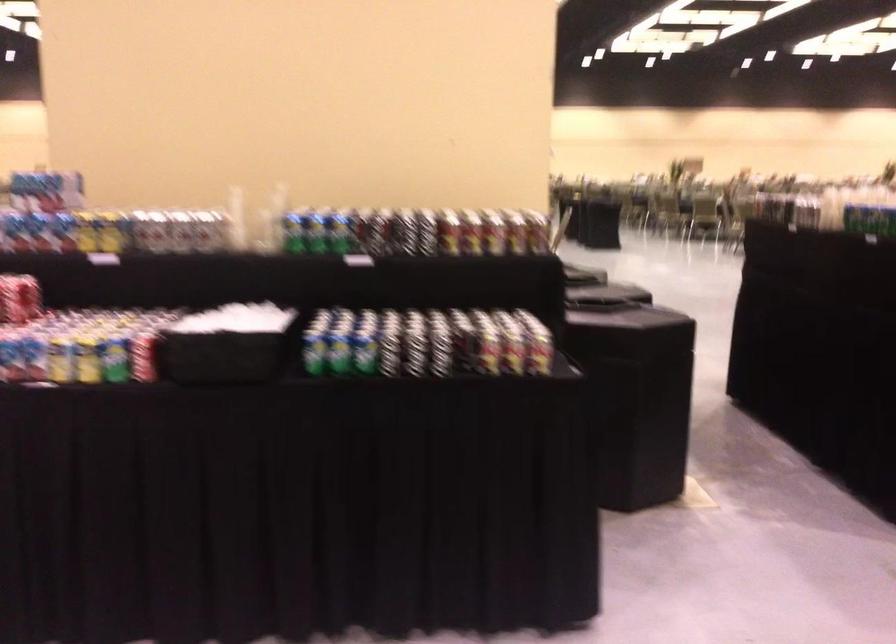
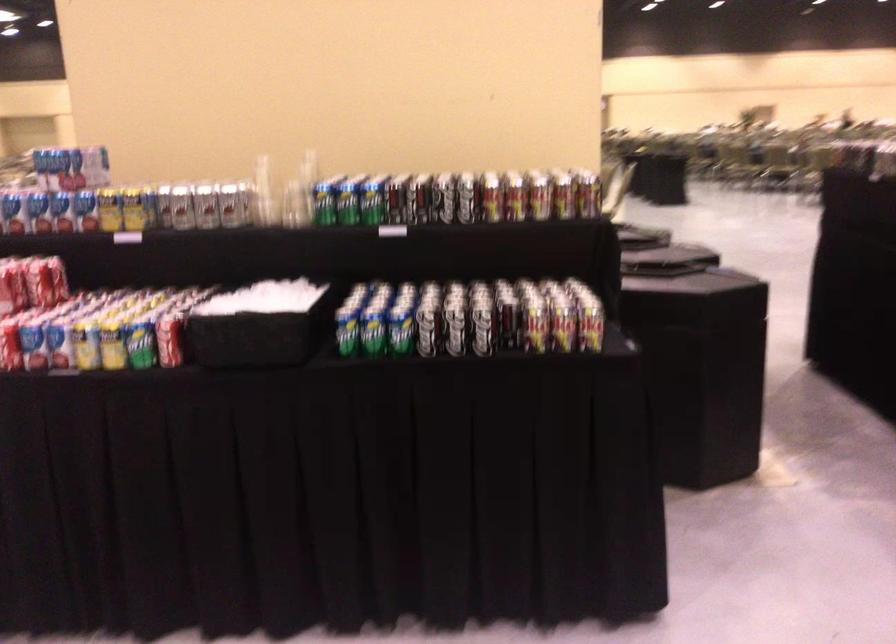
Find the pixel in the second image that matches point 365,345 in the first image.

(401, 324)